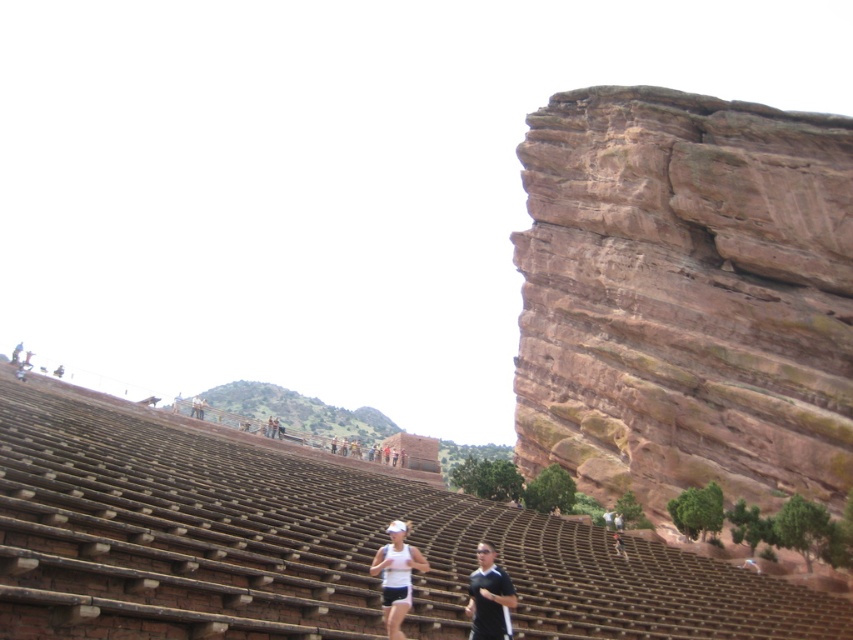
Can you confirm if rustic stone cliff at right is positioned below black fabric shirt at center?

Actually, rustic stone cliff at right is above black fabric shirt at center.

Which of these two, rustic stone cliff at right or black fabric shirt at center, stands taller?

With more height is rustic stone cliff at right.

Where is `rustic stone cliff at right`? Image resolution: width=853 pixels, height=640 pixels. rustic stone cliff at right is located at coordinates (685, 296).

Which of these two, rustic stone cliff at right or white matte tank top at center, stands taller?

Standing taller between the two is rustic stone cliff at right.

How much distance is there between rustic stone cliff at right and white matte tank top at center?

rustic stone cliff at right and white matte tank top at center are 49.87 meters apart from each other.

Who is more distant from viewer, [570,122] or [392,522]?

Positioned behind is point [570,122].

What are the coordinates of `rustic stone cliff at right` in the screenshot? It's located at [685, 296].

The image size is (853, 640). What do you see at coordinates (396, 577) in the screenshot?
I see `white matte tank top at center` at bounding box center [396, 577].

Between white matte tank top at center and black fabric shirt at center, which one has more height?

With more height is black fabric shirt at center.

Does point (402, 557) come farther from viewer compared to point (473, 572)?

No, (402, 557) is closer to viewer.

In order to click on white matte tank top at center in this screenshot , I will do `click(396, 577)`.